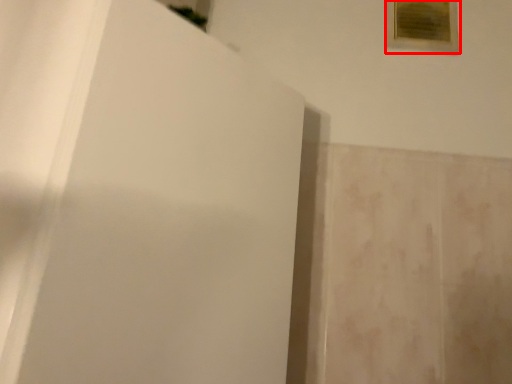
Question: From the image's perspective, where is picture frame (annotated by the red box) located relative to screen door?

Choices:
 (A) above
 (B) below

Answer: (A)